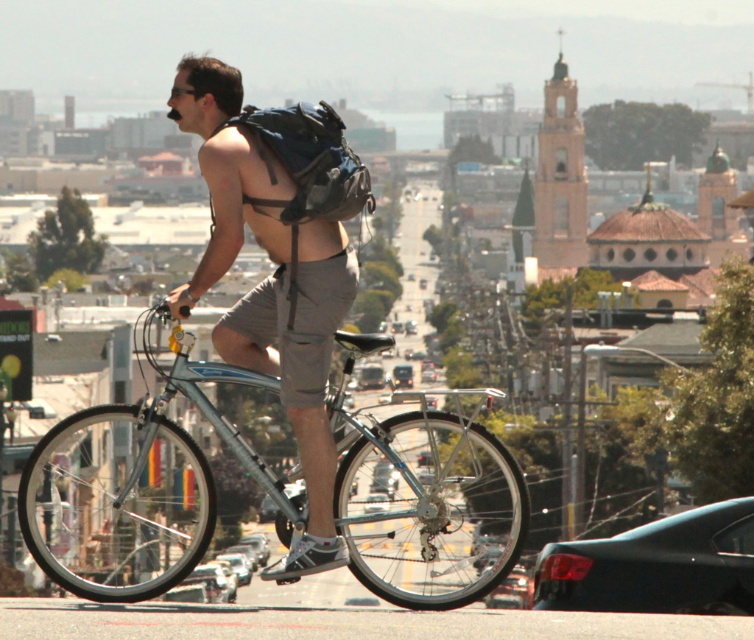
You are a delivery person who needs to place a package on the matte blue backpack at center. The package is 2 meters long. Can you carry the package while riding the silver metallic bicycle at center without it hitting the backpack?

The distance between the silver metallic bicycle at center and the matte blue backpack at center is 58.05 meters. Since the package is only 2 meters long, there is sufficient space to carry it without it hitting the backpack.